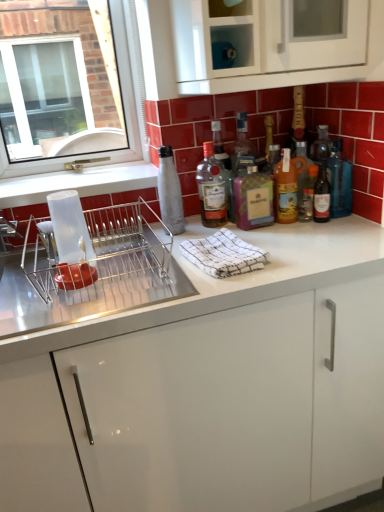
Locate an element on the screen. free space in front of translucent amber bottle at center, which appears as the fourth bottle when viewed from the left is located at coordinates (308, 237).